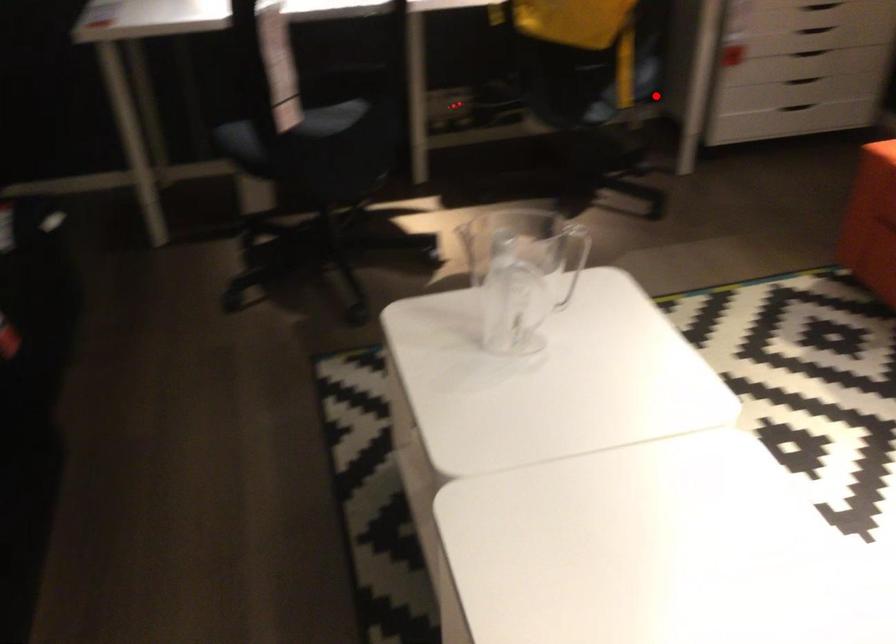
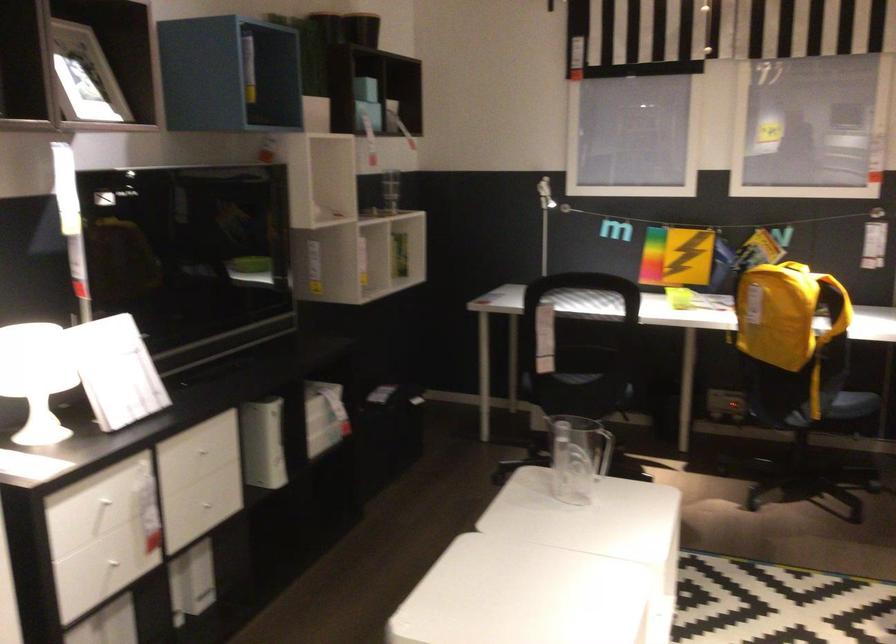
Question: I am providing you with two images of the same scene from different viewpoints. Given a red point in image1, look at the same physical point in image2. Is it:

Choices:
 (A) Closer to the viewpoint
 (B) Farther from the viewpoint

Answer: (B)